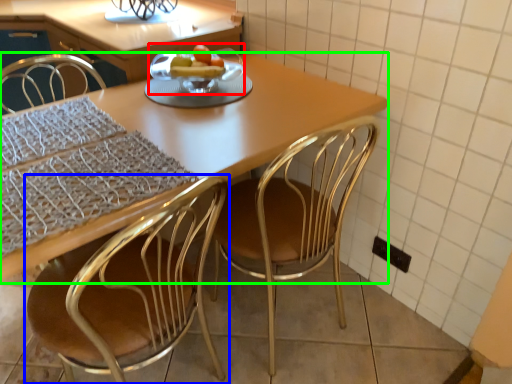
Question: Which is nearer to the fruit dish (highlighted by a red box)? chair (highlighted by a blue box) or kitchen & dining room table (highlighted by a green box).

Choices:
 (A) chair
 (B) kitchen & dining room table

Answer: (B)